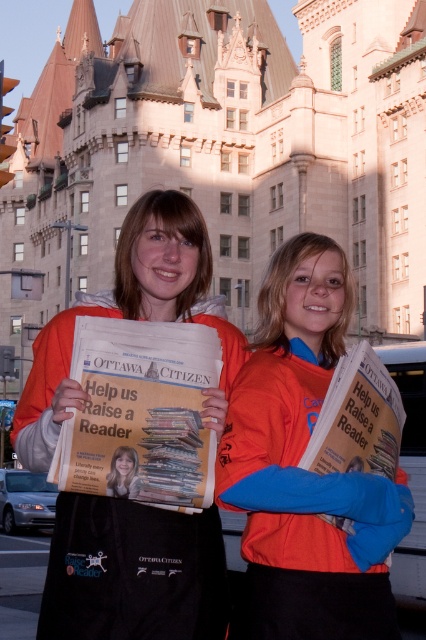
You are a photographer trying to capture a clear photo of both orange fabric jacket at center and orange fleece jacket at center. Since they are both at the center, which one is positioned more to the right?

The orange fabric jacket at center is positioned more to the right than the orange fleece jacket at center.

You are a photographer trying to capture both the orange fabric jacket at center and the orange fleece jacket at center in a single shot. Given that your camera has a maximum focus range of 3 meters, will you be able to include both jackets in the frame without moving the camera?

The orange fabric jacket at center and orange fleece jacket at center are 3.08 meters apart. Since the distance between them exceeds the camera maximum focus range of 3 meters, you won me be able to include both jackets in the frame without moving the camera.

You are a photographer trying to capture a clear shot of both the orange fabric jacket at center and the orange fleece jacket at center. Since they are both at the center, which one is closer to the camera?

The orange fabric jacket at center is positioned under the orange fleece jacket at center, so the orange fleece jacket at center is closer to the camera.